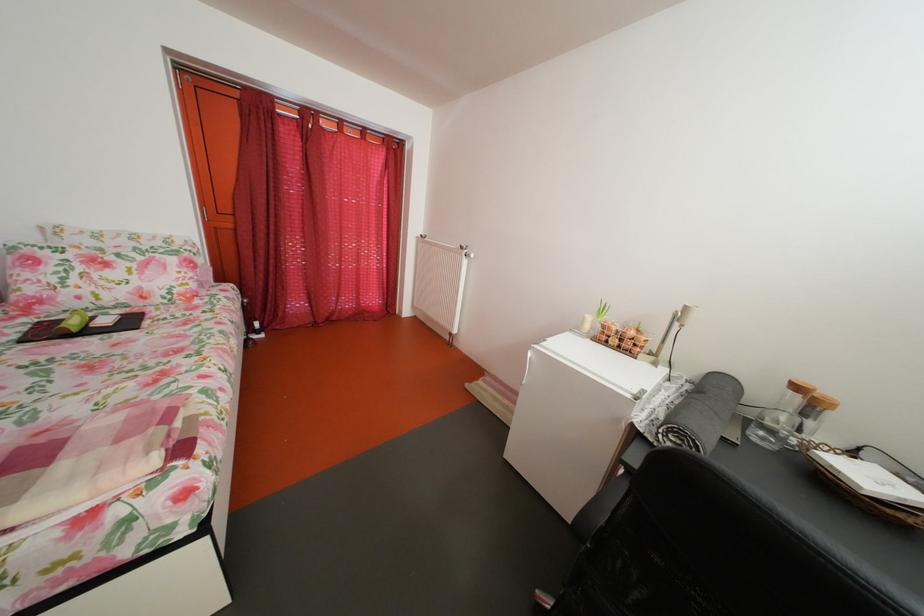
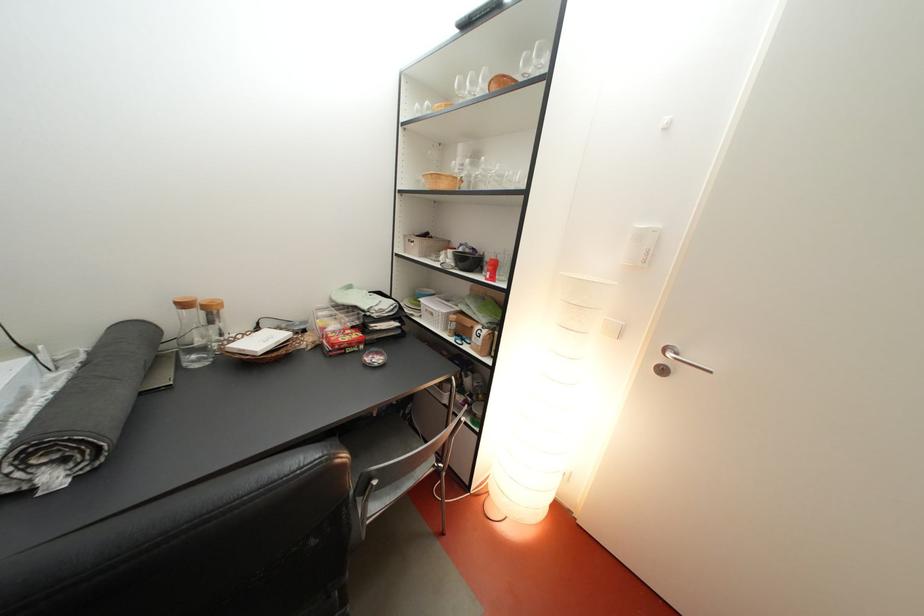
First-person continuous shooting, in which direction is the camera rotating?

The rotation direction of the camera is right-down.